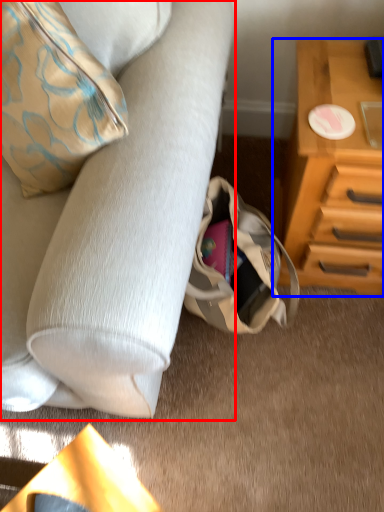
Question: Which of the following is the farthest to the observer, studio couch (highlighted by a red box) or chest of drawers (highlighted by a blue box)?

Choices:
 (A) studio couch
 (B) chest of drawers

Answer: (B)